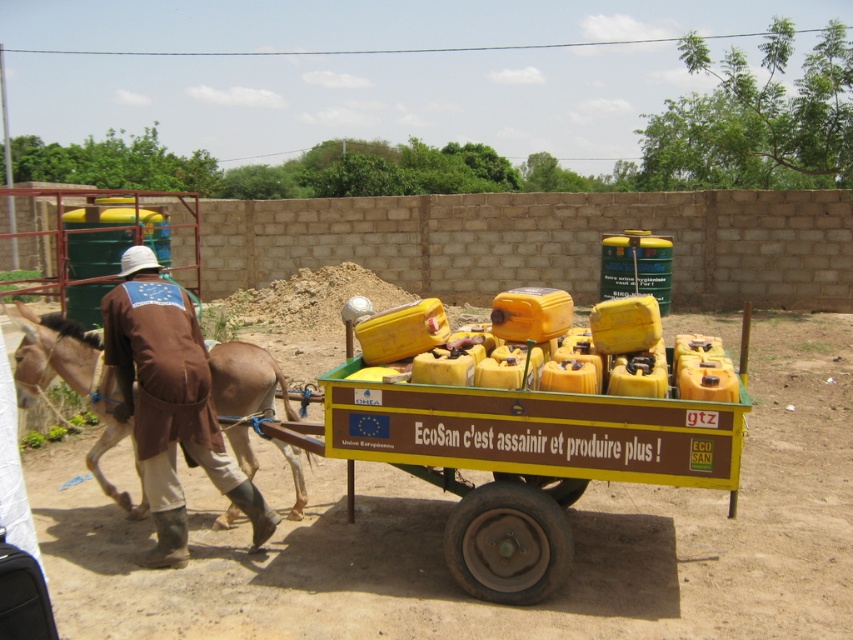
Question: Which of the following is the closest to the observer?

Choices:
 (A) (20, 326)
 (B) (161, 310)

Answer: (B)

Question: Which object appears closest to the camera in this image?

Choices:
 (A) brown leather mule at left
 (B) brown fabric jacket at left

Answer: (B)

Question: Does brown fabric jacket at left have a greater width compared to brown leather mule at left?

Choices:
 (A) yes
 (B) no

Answer: (A)

Question: Which point appears closest to the camera in this image?

Choices:
 (A) [x=239, y=454]
 (B) [x=155, y=442]

Answer: (B)

Question: Is the position of brown fabric jacket at left less distant than that of brown leather mule at left?

Choices:
 (A) yes
 (B) no

Answer: (A)

Question: Where is brown fabric jacket at left located in relation to brown leather mule at left in the image?

Choices:
 (A) below
 (B) above

Answer: (B)